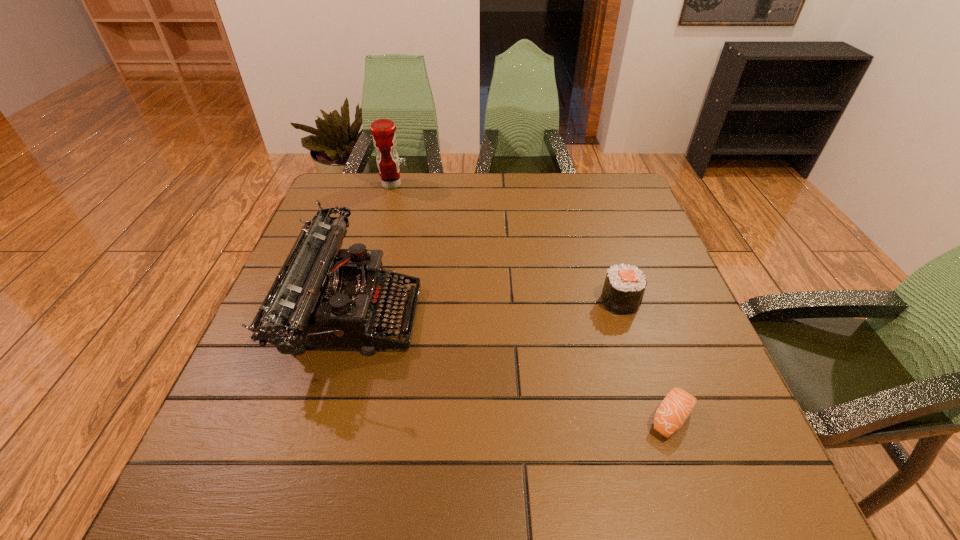
This screenshot has height=540, width=960. What are the coordinates of `condiment` in the screenshot? It's located at (384, 138).

This screenshot has width=960, height=540. What are the coordinates of `typewriter` in the screenshot? It's located at (323, 296).

In order to click on the second shortest object in this screenshot , I will do `click(624, 286)`.

Find the location of `the taller sushi`. the taller sushi is located at coordinates (624, 286).

The image size is (960, 540). Identify the location of the nearest object. (676, 407).

This screenshot has height=540, width=960. Find the location of `the shorter sushi`. the shorter sushi is located at coordinates (676, 407).

In order to click on vacant area located 0.060m on the left of the farthest object in this screenshot , I will do `click(361, 185)`.

This screenshot has height=540, width=960. Identify the location of free region located on the keyboard of the third shortest object. (556, 313).

The width and height of the screenshot is (960, 540). In order to click on free space located on the back of the taller sushi in this screenshot , I will do `click(597, 232)`.

At what (x,y) coordinates should I click in order to perform the action: click on free region located 0.050m on the back of the nearer sushi. Please return your answer as a coordinate pair (x, y). Looking at the image, I should click on (657, 374).